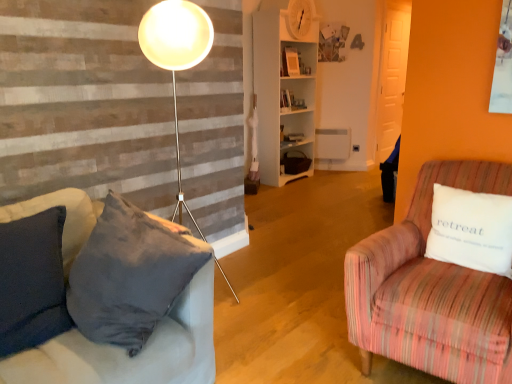
Question: Does white cotton pillow at right lie behind striped fabric armchair at right?

Choices:
 (A) no
 (B) yes

Answer: (B)

Question: Is striped fabric armchair at right a part of white cotton pillow at right?

Choices:
 (A) no
 (B) yes

Answer: (A)

Question: Considering the relative sizes of white cotton pillow at right and striped fabric armchair at right in the image provided, is white cotton pillow at right bigger than striped fabric armchair at right?

Choices:
 (A) no
 (B) yes

Answer: (A)

Question: Is white cotton pillow at right next to striped fabric armchair at right?

Choices:
 (A) no
 (B) yes

Answer: (A)

Question: From a real-world perspective, is white cotton pillow at right located beneath striped fabric armchair at right?

Choices:
 (A) yes
 (B) no

Answer: (B)

Question: Is striped fabric armchair at right to the left or to the right of white cotton pillow at right in the image?

Choices:
 (A) right
 (B) left

Answer: (B)

Question: Looking at the image, does striped fabric armchair at right seem bigger or smaller compared to white cotton pillow at right?

Choices:
 (A) big
 (B) small

Answer: (A)

Question: In the image, is striped fabric armchair at right positioned in front of or behind white cotton pillow at right?

Choices:
 (A) behind
 (B) front

Answer: (B)

Question: Considering the positions of striped fabric armchair at right and white cotton pillow at right in the image, is striped fabric armchair at right wider or thinner than white cotton pillow at right?

Choices:
 (A) thin
 (B) wide

Answer: (B)

Question: From a real-world perspective, relative to white wooden shelf at center, is white cotton pillow at right vertically above or below?

Choices:
 (A) above
 (B) below

Answer: (B)

Question: Do you think white cotton pillow at right is within white wooden shelf at center, or outside of it?

Choices:
 (A) inside
 (B) outside

Answer: (B)

Question: From the image's perspective, is white cotton pillow at right above or below white wooden shelf at center?

Choices:
 (A) above
 (B) below

Answer: (B)

Question: Is point tap(461, 220) positioned closer to the camera than point tap(285, 110)?

Choices:
 (A) closer
 (B) farther

Answer: (A)

Question: From the image's perspective, relative to white cotton pillow at right, is white wooden shelf at center above or below?

Choices:
 (A) above
 (B) below

Answer: (A)

Question: Does point (261, 178) appear closer or farther from the camera than point (459, 238)?

Choices:
 (A) farther
 (B) closer

Answer: (A)